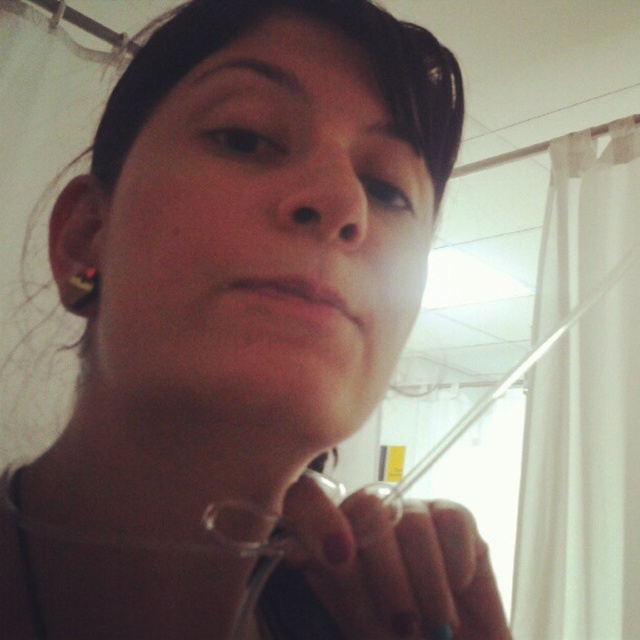
Question: Which point is farther to the camera?

Choices:
 (A) (276, 216)
 (B) (92, 285)

Answer: (B)

Question: Does clear plastic tube at lower center appear over gold shiny earring at left ear?

Choices:
 (A) yes
 (B) no

Answer: (B)

Question: Among these objects, which one is farthest from the camera?

Choices:
 (A) clear plastic tube at lower center
 (B) matte skin nose at center
 (C) gold shiny earring at left ear

Answer: (C)

Question: Does matte skin nose at center appear on the left side of gold shiny earring at left ear?

Choices:
 (A) yes
 (B) no

Answer: (B)

Question: Does matte skin nose at center appear on the right side of gold shiny earring at left ear?

Choices:
 (A) yes
 (B) no

Answer: (A)

Question: Which object is farther from the camera taking this photo?

Choices:
 (A) gold shiny earring at left ear
 (B) matte skin nose at center

Answer: (A)